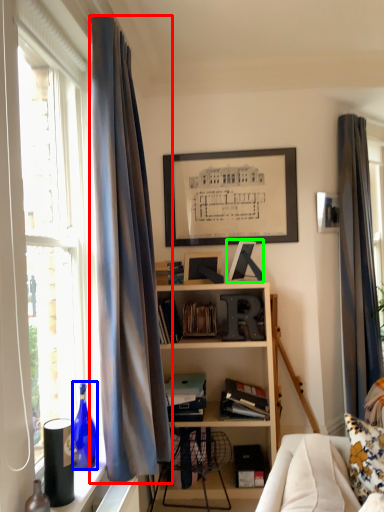
Question: Which object is positioned closest to curtain (highlighted by a red box)? Select from bottle (highlighted by a blue box) and picture frame (highlighted by a green box).

Choices:
 (A) bottle
 (B) picture frame

Answer: (A)